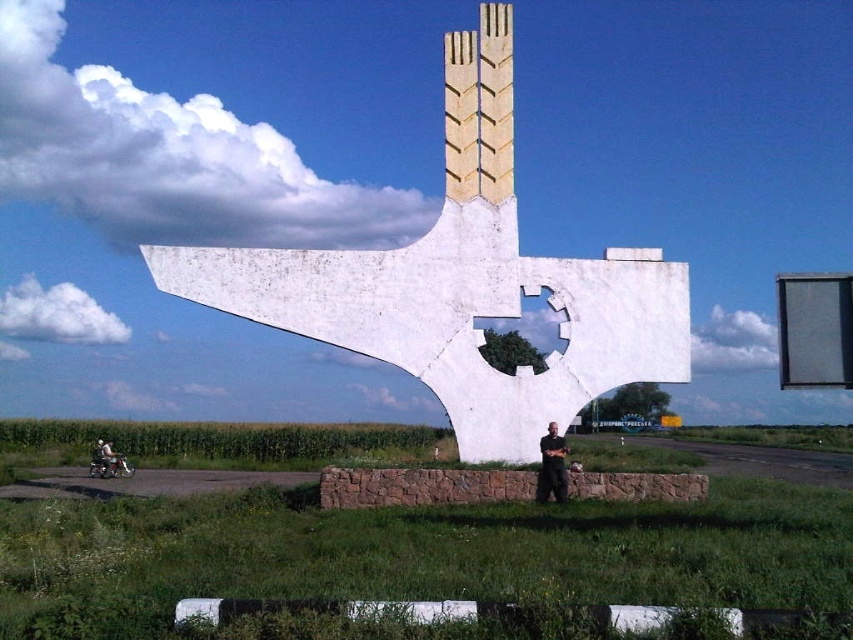
Is white concrete sculpture at center to the right of black fabric pants at center from the viewer's perspective?

No, white concrete sculpture at center is not to the right of black fabric pants at center.

Between point (518, 288) and point (556, 490), which one is positioned in front?

Point (556, 490) is in front.

Is point (641, 308) behind point (543, 483)?

Yes, point (641, 308) is behind point (543, 483).

What are the coordinates of `white concrete sculpture at center` in the screenshot? It's located at (463, 282).

Who is positioned more to the right, white concrete sculpture at center or shiny chrome motorcycle at lower left?

From the viewer's perspective, white concrete sculpture at center appears more on the right side.

Is white concrete sculpture at center below shiny chrome motorcycle at lower left?

Incorrect, white concrete sculpture at center is not positioned below shiny chrome motorcycle at lower left.

This screenshot has height=640, width=853. What do you see at coordinates (463, 282) in the screenshot?
I see `white concrete sculpture at center` at bounding box center [463, 282].

I want to click on white concrete sculpture at center, so click(463, 282).

Who is lower down, black fabric pants at center or shiny chrome motorcycle at lower left?

Positioned lower is shiny chrome motorcycle at lower left.

Is black fabric pants at center behind shiny chrome motorcycle at lower left?

That is False.

Is point (560, 438) in front of point (90, 464)?

Yes, point (560, 438) is closer to viewer.

Locate an element on the screen. Image resolution: width=853 pixels, height=640 pixels. black fabric pants at center is located at coordinates (552, 467).